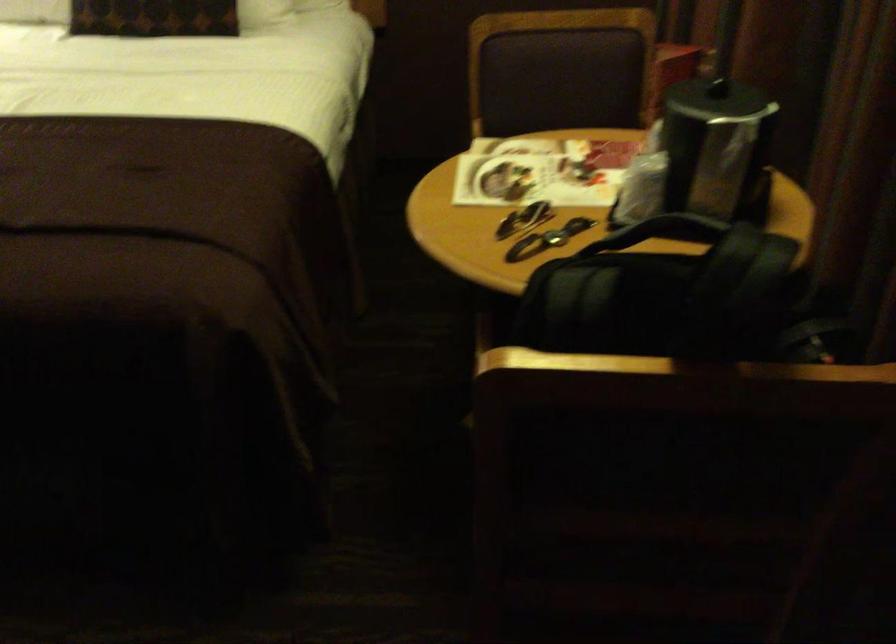
You are a GUI agent. You are given a task and a screenshot of the screen. Output one action in this format:
    pyautogui.click(x=<x>, y=<y>)
    Task: Click on the brown decorative pillow
    
    Given the screenshot: What is the action you would take?
    pyautogui.click(x=152, y=17)